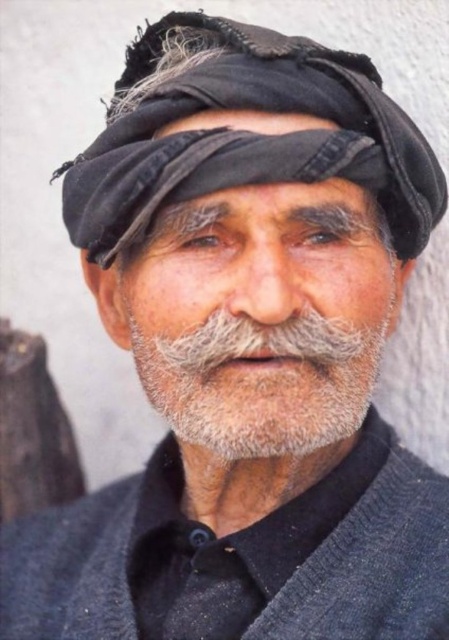
Question: Can you confirm if black fabric headscarf at upper center is bigger than gray/soft hair at center?

Choices:
 (A) no
 (B) yes

Answer: (B)

Question: Estimate the real-world distances between objects in this image. Which object is farther from the black fabric headscarf at upper center?

Choices:
 (A) dry skin at center
 (B) gray/soft hair at center

Answer: (B)

Question: Is black fabric headscarf at upper center wider than dry skin at center?

Choices:
 (A) yes
 (B) no

Answer: (A)

Question: Is black fabric headscarf at upper center below dry skin at center?

Choices:
 (A) no
 (B) yes

Answer: (B)

Question: Which of these objects is positioned farthest from the dry skin at center?

Choices:
 (A) gray/soft hair at center
 (B) black fabric headscarf at upper center

Answer: (A)

Question: Which object appears farthest from the camera in this image?

Choices:
 (A) dry skin at center
 (B) black fabric headscarf at upper center

Answer: (A)